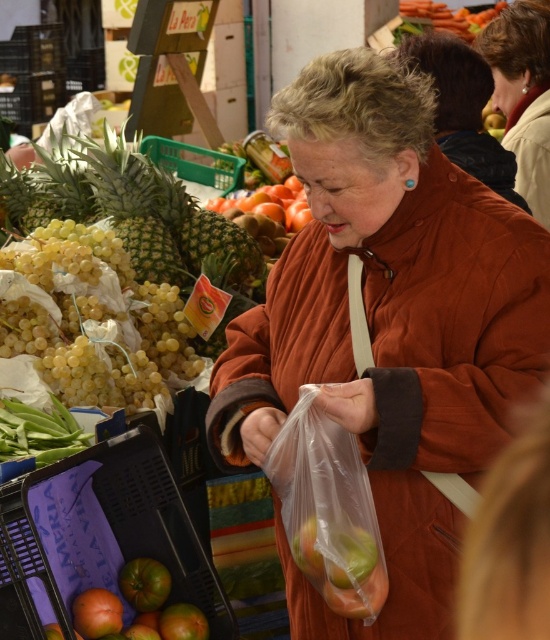
Does point (530, 40) come farther from viewer compared to point (468, 96)?

Yes.

Does brown leather jacket at upper right appear over brown fuzzy coat at center?

Yes.

Who is more distant from viewer, (477, 49) or (458, 77)?

The point (477, 49) is behind.

Where is `brown leather jacket at upper right`? The height and width of the screenshot is (640, 550). brown leather jacket at upper right is located at coordinates (522, 93).

Can you confirm if brown fuzzy coat at center is thinner than green leafy vegetable at lower left?

No, brown fuzzy coat at center is not thinner than green leafy vegetable at lower left.

In the scene shown: Is brown fuzzy coat at center above green leafy vegetable at lower left?

Yes.

This screenshot has height=640, width=550. What do you see at coordinates (463, 108) in the screenshot? I see `brown fuzzy coat at center` at bounding box center [463, 108].

The image size is (550, 640). What are the coordinates of `brown fuzzy coat at center` in the screenshot? It's located at (463, 108).

Can you confirm if ripe tomato at lower left is positioned above smooth orange carrot at upper center?

No, ripe tomato at lower left is not above smooth orange carrot at upper center.

Between ripe tomato at lower left and smooth orange carrot at upper center, which one appears on the right side from the viewer's perspective?

smooth orange carrot at upper center is more to the right.

Does point (128, 584) come behind point (466, 28)?

No.

This screenshot has width=550, height=640. Find the location of `ripe tomato at lower left`. ripe tomato at lower left is located at coordinates (138, 608).